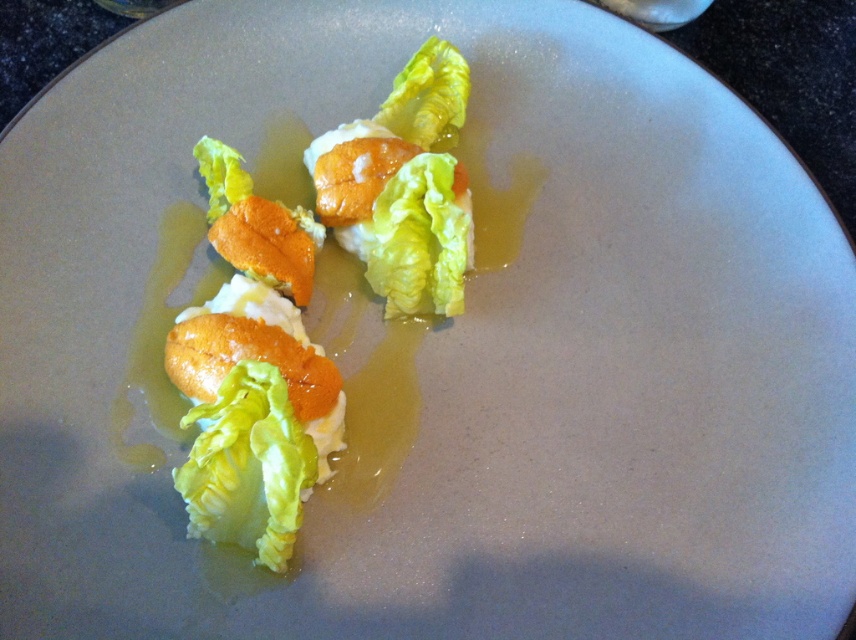
Question: Does green leafy lettuce at lower left appear on the right side of green leafy lettuce at center?

Choices:
 (A) yes
 (B) no

Answer: (B)

Question: Based on their relative distances, which object is nearer to the green leafy lettuce at lower left?

Choices:
 (A) matte orange lettuce at center
 (B) green leafy lettuce at center

Answer: (A)

Question: Based on their relative distances, which object is farther from the matte orange lettuce at center?

Choices:
 (A) green leafy lettuce at lower left
 (B) green leafy lettuce at center

Answer: (A)

Question: Can you confirm if green leafy lettuce at lower left is positioned below green leafy lettuce at center?

Choices:
 (A) yes
 (B) no

Answer: (A)

Question: Considering the real-world distances, which object is farthest from the matte orange lettuce at center?

Choices:
 (A) green leafy lettuce at center
 (B) green leafy lettuce at lower left

Answer: (B)

Question: Can you confirm if green leafy lettuce at lower left is thinner than green leafy lettuce at center?

Choices:
 (A) yes
 (B) no

Answer: (B)